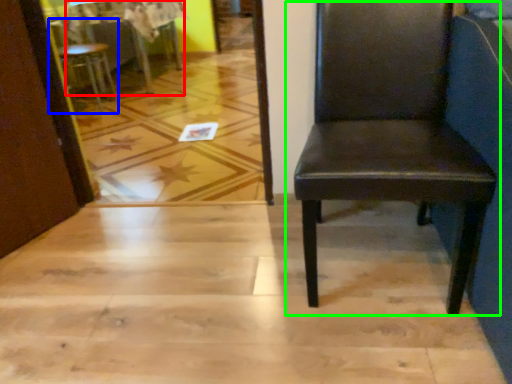
Question: Which object is the farthest from table (highlighted by a red box)? Choose among these: chair (highlighted by a blue box) or chair (highlighted by a green box).

Choices:
 (A) chair
 (B) chair

Answer: (B)